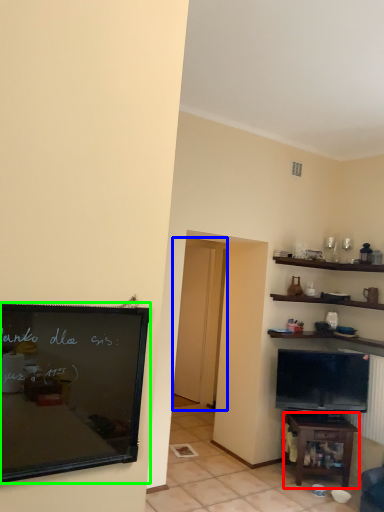
Question: Based on their relative distances, which object is nearer to table (highlighted by a red box)? Choose from glass door (highlighted by a blue box) and bulletin board (highlighted by a green box).

Choices:
 (A) glass door
 (B) bulletin board

Answer: (A)